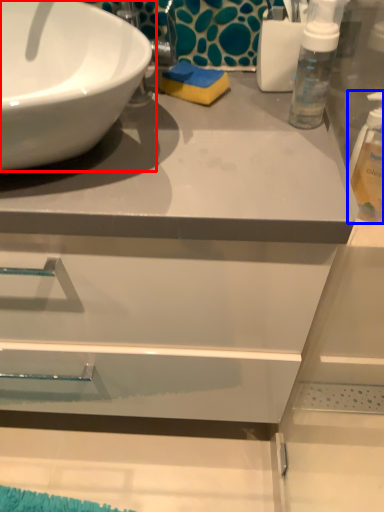
Question: Among these objects, which one is nearest to the camera, sink (highlighted by a red box) or cleaning product (highlighted by a blue box)?

Choices:
 (A) sink
 (B) cleaning product

Answer: (A)